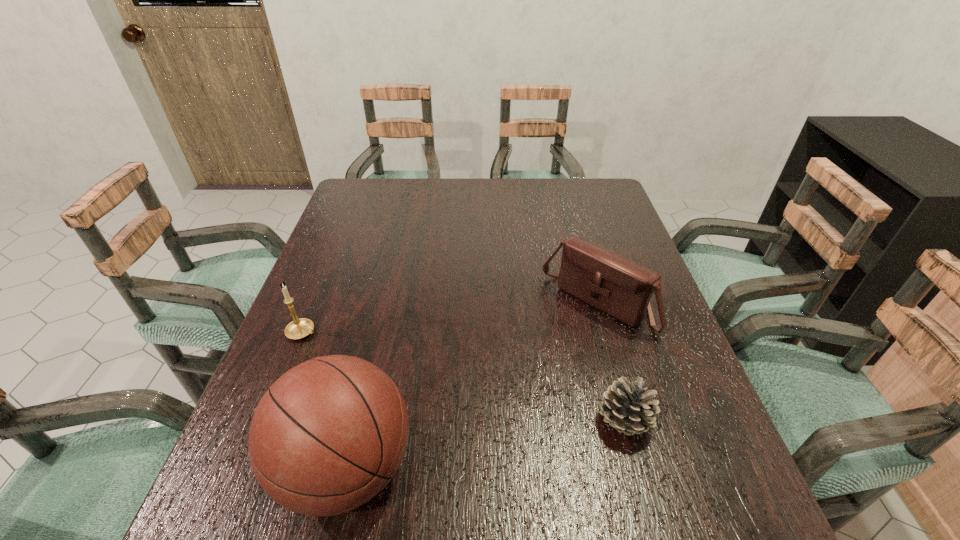
At what (x,y) coordinates should I click in order to perform the action: click on vacant space at the far right corner of the desktop. Please return your answer as a coordinate pair (x, y). The height and width of the screenshot is (540, 960). Looking at the image, I should click on (574, 191).

This screenshot has width=960, height=540. I want to click on free space between the pinecone and the leftmost object, so click(x=464, y=377).

You are a GUI agent. You are given a task and a screenshot of the screen. Output one action in this format:
    pyautogui.click(x=<x>, y=<y>)
    Task: Click on the blank region between the shortest object and the shoulder bag
    
    Given the screenshot: What is the action you would take?
    pyautogui.click(x=611, y=363)

The height and width of the screenshot is (540, 960). I want to click on blank region between the candle holder and the shortest object, so [464, 377].

Image resolution: width=960 pixels, height=540 pixels. I want to click on empty space between the pinecone and the shoulder bag, so click(x=611, y=363).

Choose which object is the third nearest neighbor to the basketball. Please provide its 2D coordinates. Your answer should be formatted as a tuple, i.e. [(x, y)], where the tuple contains the x and y coordinates of a point satisfying the conditions above.

[(628, 408)]

Identify which object is the third nearest to the leftmost object. Please provide its 2D coordinates. Your answer should be formatted as a tuple, i.e. [(x, y)], where the tuple contains the x and y coordinates of a point satisfying the conditions above.

[(628, 408)]

Where is `free space that satisfies the following two spatial constraints: 1. on the back side of the leftmost object; 2. on the right side of the shoulder bag`? This screenshot has width=960, height=540. free space that satisfies the following two spatial constraints: 1. on the back side of the leftmost object; 2. on the right side of the shoulder bag is located at coordinates (314, 306).

You are a GUI agent. You are given a task and a screenshot of the screen. Output one action in this format:
    pyautogui.click(x=<x>, y=<y>)
    Task: Click on the free space in the image that satisfies the following two spatial constraints: 1. on the back side of the shoulder bag; 2. on the right side of the candle holder
    
    Given the screenshot: What is the action you would take?
    pyautogui.click(x=314, y=306)

The height and width of the screenshot is (540, 960). What are the coordinates of `vacant space that satisfies the following two spatial constraints: 1. on the back side of the shoulder bag; 2. on the right side of the shortest object` in the screenshot? It's located at (593, 306).